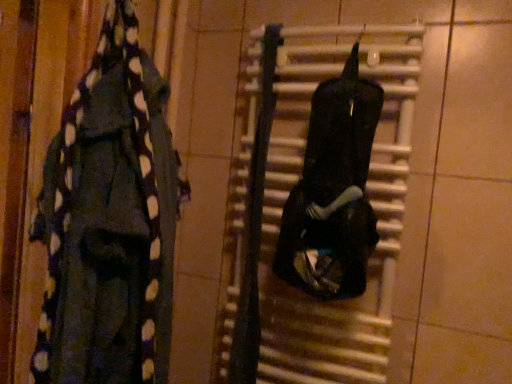
Question: From a real-world perspective, is black matte radiator at center located beneath black polka dot scarf at left, positioned as the first clothing in left-to-right order?

Choices:
 (A) no
 (B) yes

Answer: (B)

Question: Could you tell me if black matte radiator at center is facing black polka dot scarf at left, which ranks as the 2th clothing in right-to-left order?

Choices:
 (A) yes
 (B) no

Answer: (B)

Question: Is black matte radiator at center not near black polka dot scarf at left, positioned as the first clothing in left-to-right order?

Choices:
 (A) yes
 (B) no

Answer: (B)

Question: Is black matte radiator at center in front of black polka dot scarf at left, positioned as the first clothing in left-to-right order?

Choices:
 (A) no
 (B) yes

Answer: (A)

Question: Can you confirm if black matte radiator at center is thinner than black polka dot scarf at left, positioned as the first clothing in left-to-right order?

Choices:
 (A) no
 (B) yes

Answer: (B)

Question: Visually, is black matte backpack at center, the 1th clothing viewed from the right, positioned to the left or to the right of black polka dot scarf at left, positioned as the first clothing in left-to-right order?

Choices:
 (A) right
 (B) left

Answer: (A)

Question: Considering the positions of point (343, 132) and point (78, 352), is point (343, 132) closer or farther from the camera than point (78, 352)?

Choices:
 (A) farther
 (B) closer

Answer: (A)

Question: Considering their positions, is black matte backpack at center, the 1th clothing viewed from the right, located in front of or behind black polka dot scarf at left, which ranks as the 2th clothing in right-to-left order?

Choices:
 (A) front
 (B) behind

Answer: (B)

Question: Considering the positions of black matte backpack at center, the second clothing from the left, and black polka dot scarf at left, positioned as the first clothing in left-to-right order, in the image, is black matte backpack at center, the second clothing from the left, bigger or smaller than black polka dot scarf at left, positioned as the first clothing in left-to-right order,?

Choices:
 (A) small
 (B) big

Answer: (A)

Question: Looking at the image, does black matte radiator at center seem bigger or smaller compared to black matte backpack at center, the second clothing from the left?

Choices:
 (A) small
 (B) big

Answer: (B)

Question: Is black matte radiator at center in front of or behind black matte backpack at center, the second clothing from the left, in the image?

Choices:
 (A) front
 (B) behind

Answer: (B)

Question: Is black matte radiator at center spatially inside black matte backpack at center, the 1th clothing viewed from the right, or outside of it?

Choices:
 (A) inside
 (B) outside

Answer: (B)

Question: Is black matte radiator at center to the left or to the right of black matte backpack at center, the second clothing from the left, in the image?

Choices:
 (A) left
 (B) right

Answer: (A)

Question: Relative to black polka dot scarf at left, which ranks as the 2th clothing in right-to-left order, is black matte radiator at center in front or behind?

Choices:
 (A) front
 (B) behind

Answer: (B)

Question: Considering the positions of black matte radiator at center and black polka dot scarf at left, positioned as the first clothing in left-to-right order, in the image, is black matte radiator at center wider or thinner than black polka dot scarf at left, positioned as the first clothing in left-to-right order,?

Choices:
 (A) wide
 (B) thin

Answer: (B)